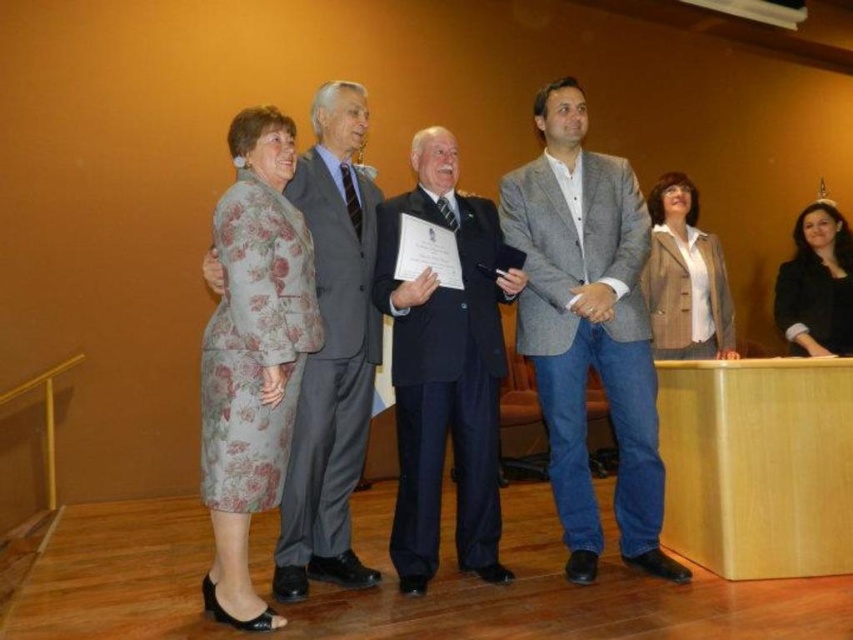
Question: Based on their relative distances, which object is nearer to the gray wool suit at left?

Choices:
 (A) floral fabric dress at left
 (B) dark blue suit at center
 (C) gray wool blazer at center

Answer: (B)

Question: Does gray wool suit at left have a smaller size compared to light brown textured blazer at center?

Choices:
 (A) no
 (B) yes

Answer: (A)

Question: Can you confirm if dark blue suit at center is positioned below floral fabric dress at left?

Choices:
 (A) no
 (B) yes

Answer: (A)

Question: Does gray wool blazer at center have a smaller size compared to light brown textured blazer at center?

Choices:
 (A) yes
 (B) no

Answer: (B)

Question: Which of the following is the closest to the observer?

Choices:
 (A) light brown textured blazer at center
 (B) floral fabric dress at left
 (C) dark blue suit at center
 (D) gray wool blazer at center

Answer: (B)

Question: Among these objects, which one is farthest from the camera?

Choices:
 (A) dark blue suit at center
 (B) gray wool blazer at center

Answer: (B)